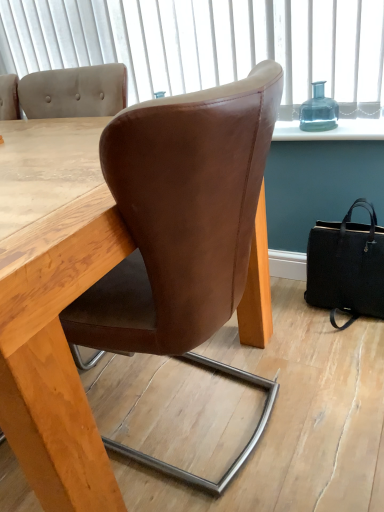
Question: Is transparent glass bottle at upper right not within black leather handbag at lower right?

Choices:
 (A) yes
 (B) no

Answer: (A)

Question: Can you confirm if transparent glass bottle at upper right is positioned to the left of black leather handbag at lower right?

Choices:
 (A) no
 (B) yes

Answer: (B)

Question: Is the position of transparent glass bottle at upper right more distant than that of black leather handbag at lower right?

Choices:
 (A) no
 (B) yes

Answer: (B)

Question: From a real-world perspective, is transparent glass bottle at upper right beneath black leather handbag at lower right?

Choices:
 (A) no
 (B) yes

Answer: (A)

Question: From a real-world perspective, is transparent glass bottle at upper right located higher than black leather handbag at lower right?

Choices:
 (A) no
 (B) yes

Answer: (B)

Question: From the image's perspective, is transparent glass bottle at upper right positioned above or below brown leather chair at center?

Choices:
 (A) below
 (B) above

Answer: (B)

Question: Does point (311, 113) appear closer or farther from the camera than point (256, 439)?

Choices:
 (A) farther
 (B) closer

Answer: (A)

Question: Is transparent glass bottle at upper right wider or thinner than brown leather chair at center?

Choices:
 (A) wide
 (B) thin

Answer: (B)

Question: In the image, is transparent glass bottle at upper right positioned in front of or behind brown leather chair at center?

Choices:
 (A) behind
 (B) front

Answer: (A)

Question: From the image's perspective, is brown leather chair at center located above or below transparent glass bottle at upper right?

Choices:
 (A) below
 (B) above

Answer: (A)

Question: Considering the positions of point (177, 295) and point (314, 88), is point (177, 295) closer or farther from the camera than point (314, 88)?

Choices:
 (A) farther
 (B) closer

Answer: (B)

Question: Is brown leather chair at center taller or shorter than transparent glass bottle at upper right?

Choices:
 (A) short
 (B) tall

Answer: (B)

Question: From a real-world perspective, is brown leather chair at center above or below transparent glass bottle at upper right?

Choices:
 (A) below
 (B) above

Answer: (A)

Question: From a real-world perspective, is black leather handbag at lower right positioned above or below brown leather chair at center?

Choices:
 (A) above
 (B) below

Answer: (B)

Question: In the image, is black leather handbag at lower right on the left side or the right side of brown leather chair at center?

Choices:
 (A) left
 (B) right

Answer: (B)